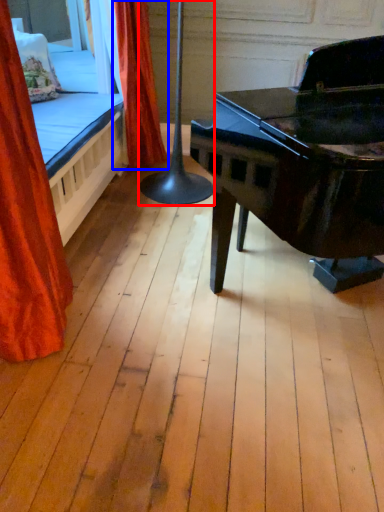
Question: Among these objects, which one is farthest to the camera, table lamp (highlighted by a red box) or curtain (highlighted by a blue box)?

Choices:
 (A) table lamp
 (B) curtain

Answer: (B)